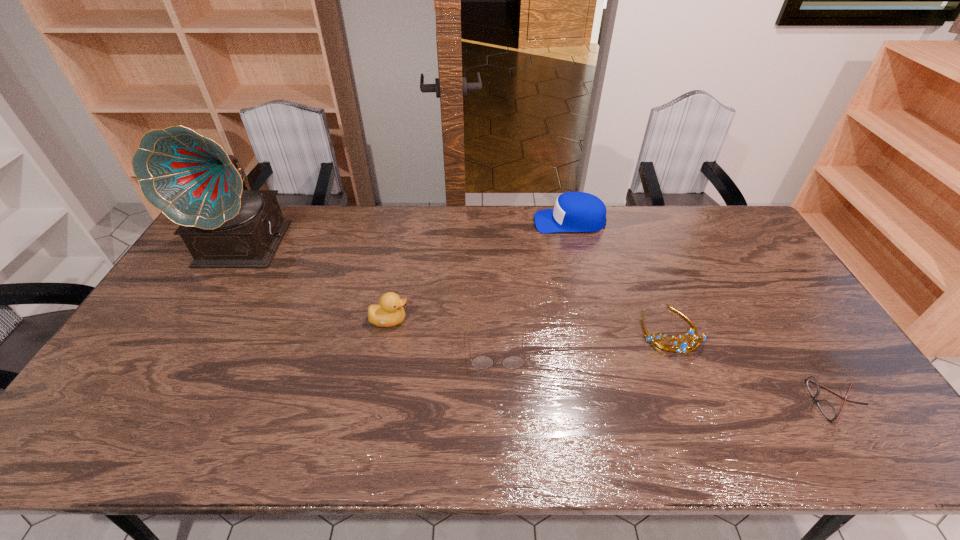
Identify the location of free space located 0.380m on the front-facing side of the baseball cap. (430, 222).

Where is `free space located on the front-facing side of the baseball cap`? free space located on the front-facing side of the baseball cap is located at coordinates (493, 222).

Identify the location of vacant position located on the front-facing side of the baseball cap. Image resolution: width=960 pixels, height=540 pixels. (491, 222).

This screenshot has height=540, width=960. Identify the location of free space located facing forward on the duckling. (447, 320).

Identify the location of vacant space located on the front-facing side of the tiara. (698, 398).

Locate an element on the screen. This screenshot has width=960, height=540. free space located 0.170m on the temples of the third object from left to right is located at coordinates (500, 434).

In order to click on free location located 0.300m on the front-facing side of the shorter spectacles in this screenshot , I will do `click(692, 401)`.

What are the coordinates of `vacant space located 0.240m on the front-facing side of the shorter spectacles` in the screenshot? It's located at (716, 401).

The height and width of the screenshot is (540, 960). What are the coordinates of `vacant space located on the front-facing side of the shorter spectacles` in the screenshot? It's located at (769, 401).

Identify the location of record player present at the far edge. The image size is (960, 540). (190, 178).